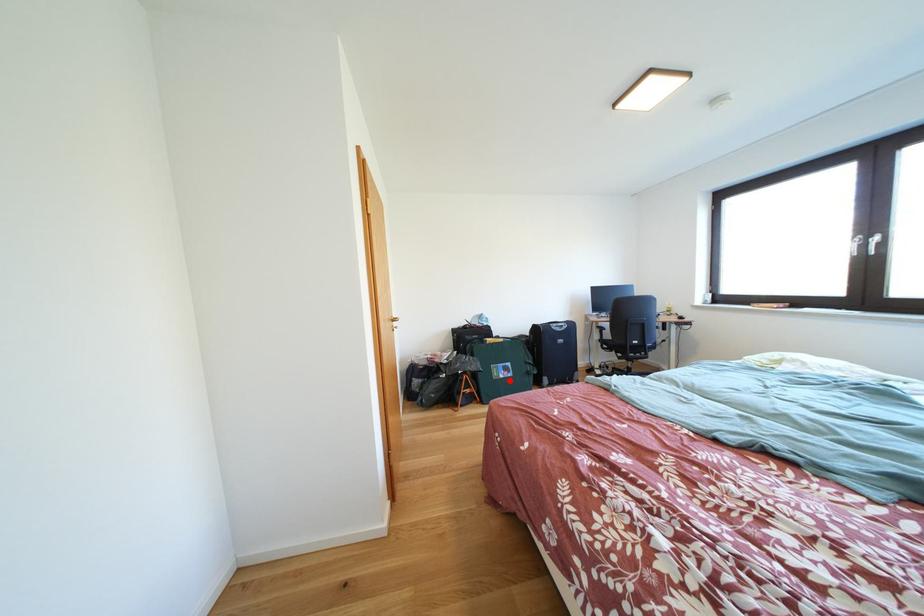
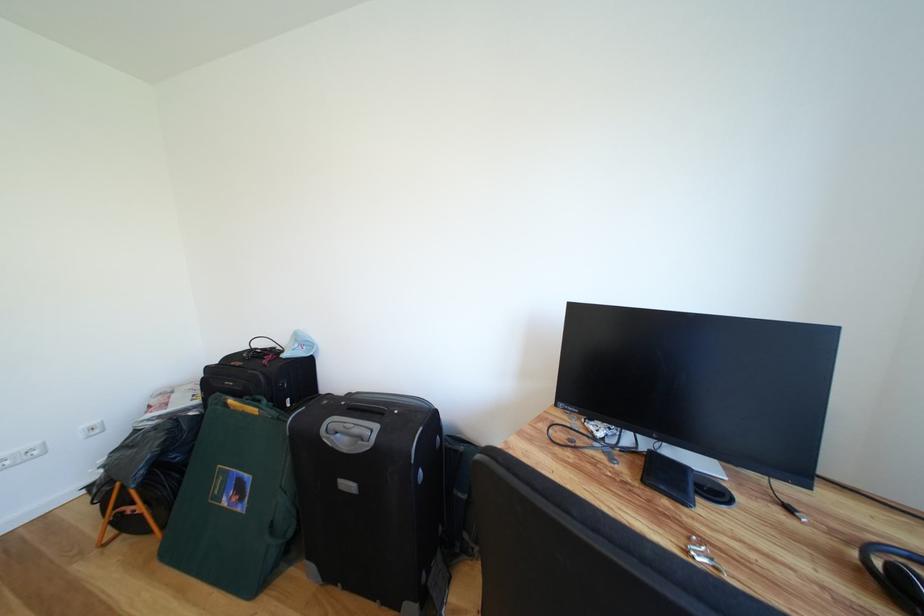
Question: I am providing you with two images of the same scene from different viewpoints. A red point is marked on the first image. Can you still see the location of the red point in image 2?

Choices:
 (A) Yes
 (B) No

Answer: (A)